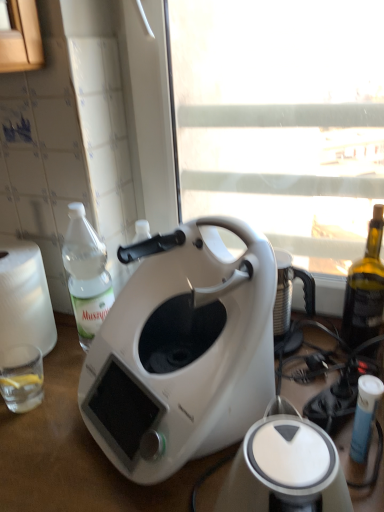
I want to click on vacant space positioned to the left of white matte coffee maker at center, so click(54, 440).